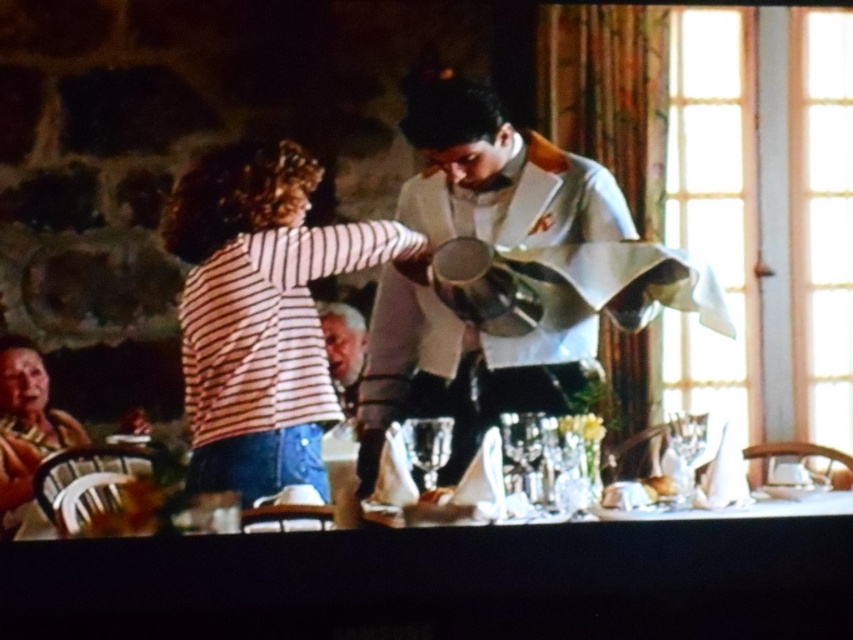
Question: Is white glossy table at center smaller than metallic silver pitcher at center?

Choices:
 (A) no
 (B) yes

Answer: (A)

Question: Which point is closer to the camera taking this photo?

Choices:
 (A) (602, 524)
 (B) (635, 292)

Answer: (A)

Question: Which object is positioned farthest from the white glossy table at center?

Choices:
 (A) striped fabric shirt at center
 (B) metallic silver pitcher at center

Answer: (B)

Question: Is white glossy table at center above clear glass wine glass at center?

Choices:
 (A) yes
 (B) no

Answer: (B)

Question: Considering the relative positions of white glossy table at center and metallic silver pitcher at center in the image provided, where is white glossy table at center located with respect to metallic silver pitcher at center?

Choices:
 (A) above
 (B) below

Answer: (B)

Question: Among these points, which one is nearest to the camera?

Choices:
 (A) (403, 384)
 (B) (405, 448)

Answer: (B)